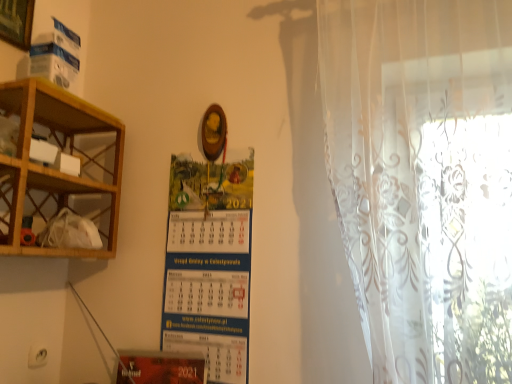
The image size is (512, 384). What do you see at coordinates (209, 290) in the screenshot?
I see `blue paper calendar at center` at bounding box center [209, 290].

I want to click on blue paper calendar at center, so click(209, 290).

Where is `wooden picture frame at upper left`? wooden picture frame at upper left is located at coordinates (16, 22).

This screenshot has height=384, width=512. Identify the location of blue paper calendar at center. (209, 290).

Is transparent floral curtain at right beside wooden picture frame at upper left?

No, transparent floral curtain at right is not making contact with wooden picture frame at upper left.

From the picture: From a real-world perspective, which is physically below, transparent floral curtain at right or wooden picture frame at upper left?

transparent floral curtain at right.

Considering the relative sizes of transparent floral curtain at right and wooden picture frame at upper left in the image provided, is transparent floral curtain at right taller than wooden picture frame at upper left?

Yes, transparent floral curtain at right is taller than wooden picture frame at upper left.

Considering the relative positions of blue paper calendar at center and wooden shelf at left in the image provided, is blue paper calendar at center to the left of wooden shelf at left from the viewer's perspective?

No, blue paper calendar at center is not to the left of wooden shelf at left.

Is blue paper calendar at center far away from wooden shelf at left?

Actually, blue paper calendar at center and wooden shelf at left are a little close together.

From the image's perspective, is blue paper calendar at center located above or below wooden shelf at left?

blue paper calendar at center is situated lower than wooden shelf at left in the image.

Is blue paper calendar at center facing away from wooden shelf at left?

No, blue paper calendar at center is not facing the opposite direction of wooden shelf at left.

How different are the orientations of wooden picture frame at upper left and blue paper calendar at center in degrees?

88.7 degrees separate the facing orientations of wooden picture frame at upper left and blue paper calendar at center.

Considering the sizes of wooden picture frame at upper left and blue paper calendar at center in the image, is wooden picture frame at upper left wider or thinner than blue paper calendar at center?

wooden picture frame at upper left is wider than blue paper calendar at center.

Is wooden picture frame at upper left inside the boundaries of blue paper calendar at center, or outside?

wooden picture frame at upper left is not enclosed by blue paper calendar at center.

Is wooden picture frame at upper left not close to blue paper calendar at center?

No.

In the image, is wooden shelf at left positioned in front of or behind transparent floral curtain at right?

In the image, wooden shelf at left appears behind transparent floral curtain at right.

Can you confirm if wooden shelf at left is taller than transparent floral curtain at right?

No, wooden shelf at left is not taller than transparent floral curtain at right.

Is wooden shelf at left completely or partially outside of transparent floral curtain at right?

Yes.

This screenshot has width=512, height=384. I want to click on curtain located in front of the wooden shelf at left, so click(424, 180).

Considering the sizes of transparent floral curtain at right and wooden shelf at left in the image, is transparent floral curtain at right taller or shorter than wooden shelf at left?

Clearly, transparent floral curtain at right is taller compared to wooden shelf at left.

In the scene shown: In terms of width, does transparent floral curtain at right look wider or thinner when compared to wooden shelf at left?

Clearly, transparent floral curtain at right has less width compared to wooden shelf at left.

The height and width of the screenshot is (384, 512). I want to click on curtain to the right of wooden shelf at left, so click(x=424, y=180).

From a real-world perspective, is transparent floral curtain at right positioned above or below wooden shelf at left?

Clearly, from a real-world perspective, transparent floral curtain at right is above wooden shelf at left.

Considering the points (0, 172) and (27, 44), which point is in front, point (0, 172) or point (27, 44)?

The point (0, 172) is more forward.

In the image, is wooden shelf at left positioned in front of or behind wooden picture frame at upper left?

Clearly, wooden shelf at left is in front of wooden picture frame at upper left.

How distant is wooden shelf at left from wooden picture frame at upper left?

17.70 inches.

Considering the sizes of objects wooden shelf at left and wooden picture frame at upper left in the image provided, who is bigger, wooden shelf at left or wooden picture frame at upper left?

wooden shelf at left is bigger.

Does wooden shelf at left appear on the left side of blue paper calendar at center?

Indeed, wooden shelf at left is positioned on the left side of blue paper calendar at center.

Relative to blue paper calendar at center, is wooden shelf at left in front or behind?

Visually, wooden shelf at left is located in front of blue paper calendar at center.

Is wooden shelf at left wider or thinner than blue paper calendar at center?

Clearly, wooden shelf at left has more width compared to blue paper calendar at center.

Find the location of a particular element. The height and width of the screenshot is (384, 512). shelf above the blue paper calendar at center (from a real-world perspective) is located at coordinates (59, 171).

Identify the location of curtain located in front of the wooden picture frame at upper left. The width and height of the screenshot is (512, 384). (424, 180).

At what (x,y) coordinates should I click in order to perform the action: click on writing on the right of wooden shelf at left. Please return your answer as a coordinate pair (x, y). The image size is (512, 384). Looking at the image, I should click on (209, 290).

When comparing their distances from wooden shelf at left, does wooden picture frame at upper left or transparent floral curtain at right seem further?

Based on the image, transparent floral curtain at right appears to be further to wooden shelf at left.

When comparing their distances from transparent floral curtain at right, does blue paper calendar at center or wooden picture frame at upper left seem further?

Among the two, wooden picture frame at upper left is located further to transparent floral curtain at right.

Considering their positions, is transparent floral curtain at right positioned closer to wooden picture frame at upper left than blue paper calendar at center?

blue paper calendar at center is closer to wooden picture frame at upper left.

In the scene shown: Based on their spatial positions, is blue paper calendar at center or wooden picture frame at upper left further from wooden shelf at left?

The object further to wooden shelf at left is wooden picture frame at upper left.

Based on their spatial positions, is wooden picture frame at upper left or blue paper calendar at center closer to wooden shelf at left?

Among the two, blue paper calendar at center is located nearer to wooden shelf at left.

Considering their positions, is wooden picture frame at upper left positioned closer to blue paper calendar at center than wooden shelf at left?

Based on the image, wooden shelf at left appears to be nearer to blue paper calendar at center.

Looking at the image, which one is located further to transparent floral curtain at right, blue paper calendar at center or wooden shelf at left?

wooden shelf at left lies further to transparent floral curtain at right than the other object.

From the image, which object appears to be nearer to blue paper calendar at center, transparent floral curtain at right or wooden shelf at left?

The object closer to blue paper calendar at center is wooden shelf at left.

I want to click on writing between wooden shelf at left and transparent floral curtain at right from left to right, so click(209, 290).

Where is `shelf between wooden picture frame at upper left and transparent floral curtain at right from left to right`? This screenshot has height=384, width=512. shelf between wooden picture frame at upper left and transparent floral curtain at right from left to right is located at coordinates (59, 171).

The height and width of the screenshot is (384, 512). I want to click on writing situated between wooden picture frame at upper left and transparent floral curtain at right from left to right, so click(209, 290).

Locate an element on the screen. The height and width of the screenshot is (384, 512). shelf between wooden picture frame at upper left and blue paper calendar at center vertically is located at coordinates (59, 171).